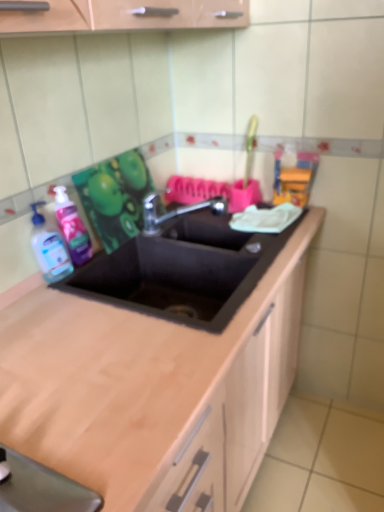
Question: Considering the relative sizes of translucent plastic soap dispenser at left and black matte sink at center in the image provided, is translucent plastic soap dispenser at left shorter than black matte sink at center?

Choices:
 (A) yes
 (B) no

Answer: (A)

Question: Is translucent plastic soap dispenser at left smaller than black matte sink at center?

Choices:
 (A) no
 (B) yes

Answer: (B)

Question: Is black matte sink at center a part of translucent plastic soap dispenser at left?

Choices:
 (A) no
 (B) yes

Answer: (A)

Question: From a real-world perspective, is translucent plastic soap dispenser at left physically above black matte sink at center?

Choices:
 (A) no
 (B) yes

Answer: (B)

Question: Is translucent plastic soap dispenser at left far away from black matte sink at center?

Choices:
 (A) no
 (B) yes

Answer: (A)

Question: From the image's perspective, relative to translucent plastic soap dispenser at left, is metallic faucet at center above or below?

Choices:
 (A) below
 (B) above

Answer: (B)

Question: Considering the positions of metallic faucet at center and translucent plastic soap dispenser at left in the image, is metallic faucet at center wider or thinner than translucent plastic soap dispenser at left?

Choices:
 (A) wide
 (B) thin

Answer: (A)

Question: Would you say metallic faucet at center is inside or outside translucent plastic soap dispenser at left?

Choices:
 (A) inside
 (B) outside

Answer: (B)

Question: Is point (190, 208) closer or farther from the camera than point (54, 190)?

Choices:
 (A) farther
 (B) closer

Answer: (A)

Question: From a real-world perspective, is black matte sink at center physically located above or below translucent plastic soap dispenser at left?

Choices:
 (A) above
 (B) below

Answer: (B)

Question: Is black matte sink at center in front of or behind translucent plastic soap dispenser at left in the image?

Choices:
 (A) front
 (B) behind

Answer: (A)

Question: From the image's perspective, relative to translucent plastic soap dispenser at left, is black matte sink at center above or below?

Choices:
 (A) below
 (B) above

Answer: (A)

Question: Does point (122, 303) appear closer or farther from the camera than point (77, 236)?

Choices:
 (A) farther
 (B) closer

Answer: (B)

Question: Considering the positions of transparent plastic bottle at left and translucent plastic soap dispenser at left in the image, is transparent plastic bottle at left taller or shorter than translucent plastic soap dispenser at left?

Choices:
 (A) short
 (B) tall

Answer: (A)

Question: From a real-world perspective, relative to translucent plastic soap dispenser at left, is transparent plastic bottle at left vertically above or below?

Choices:
 (A) below
 (B) above

Answer: (A)